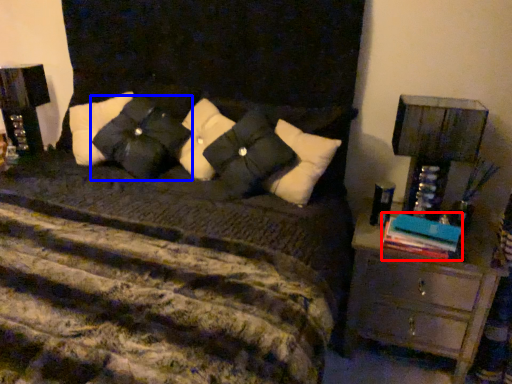
Question: Which object appears farthest to the camera in this image, book (highlighted by a red box) or pillow (highlighted by a blue box)?

Choices:
 (A) book
 (B) pillow

Answer: (B)